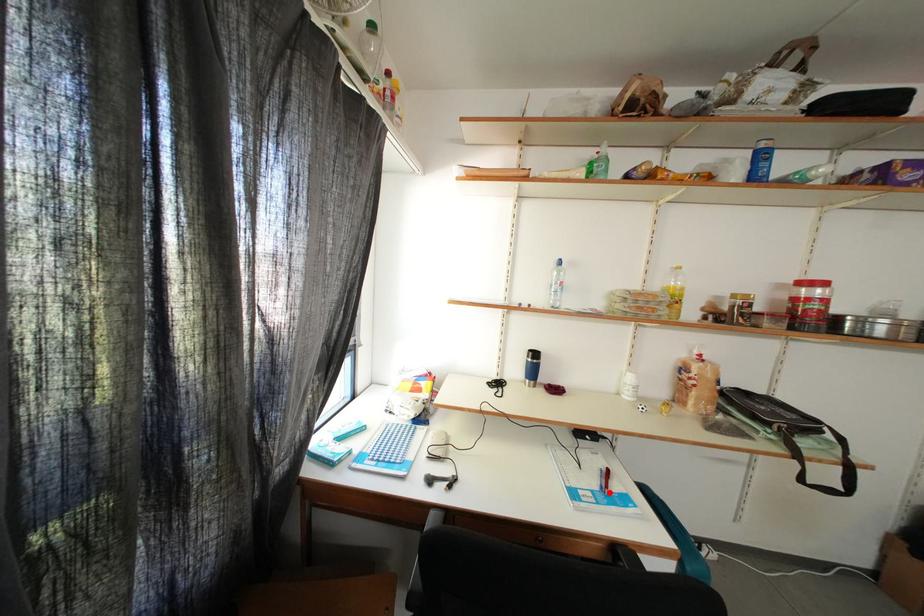
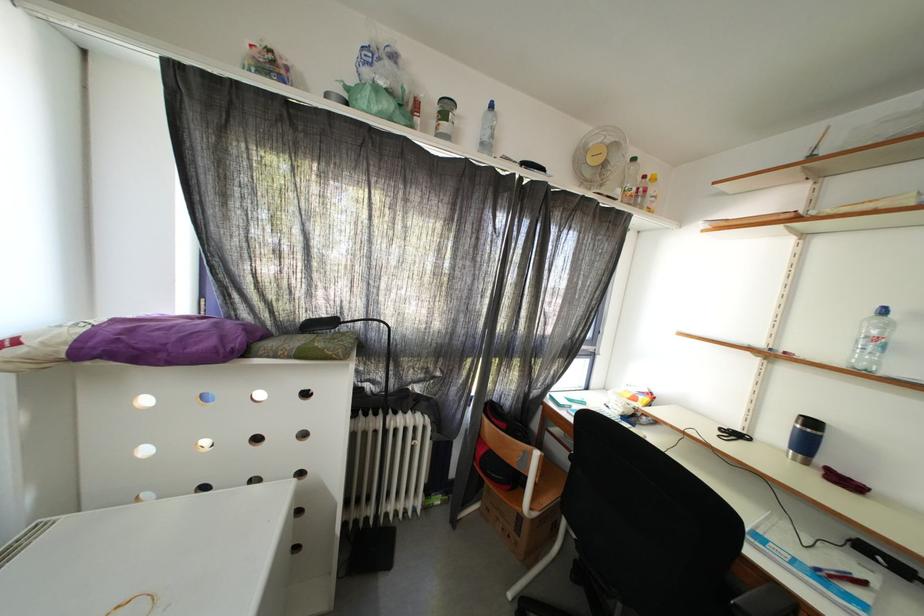
Question: I am providing you with two images of the same scene from different viewpoints. Given a red point in image1, look at the same physical point in image2. Is it:

Choices:
 (A) Closer to the viewpoint
 (B) Farther from the viewpoint

Answer: (A)